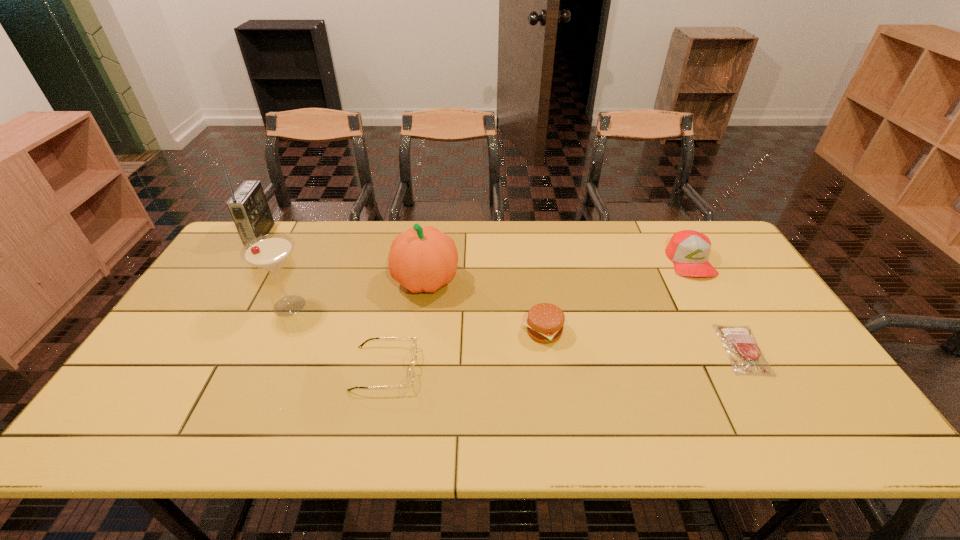
This screenshot has height=540, width=960. I want to click on baseball cap situated at the right edge, so click(689, 250).

At what (x,y) coordinates should I click in order to perform the action: click on steak that is positioned at the right edge. Please return your answer as a coordinate pair (x, y). Looking at the image, I should click on (739, 342).

Locate an element on the screen. The width and height of the screenshot is (960, 540). object at the far left corner is located at coordinates (248, 206).

Locate an element on the screen. The image size is (960, 540). object situated at the far right corner is located at coordinates (689, 250).

Where is `vacant space at the far edge of the desktop`? vacant space at the far edge of the desktop is located at coordinates (538, 249).

You are a GUI agent. You are given a task and a screenshot of the screen. Output one action in this format:
    pyautogui.click(x=<x>, y=<y>)
    Task: Click on the vacant space at the near edge
    
    Given the screenshot: What is the action you would take?
    pyautogui.click(x=527, y=432)

I want to click on vacant space at the left edge of the desktop, so click(247, 268).

In the image, there is a desktop. Where is `free space at the right edge`? This screenshot has width=960, height=540. free space at the right edge is located at coordinates (718, 276).

Identify the location of empty location between the fourth shortest object and the sixth object from right to left. (490, 284).

This screenshot has width=960, height=540. In order to click on empty location between the pumpkin and the baseball cap in this screenshot , I will do `click(558, 271)`.